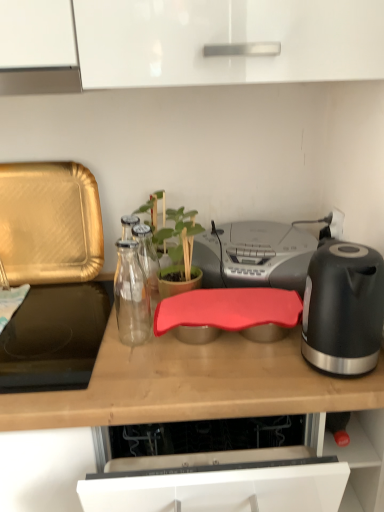
Locate an element on the screen. vacant space underneath metallic silver exhaust hood at upper left (from a real-world perspective) is located at coordinates (57, 307).